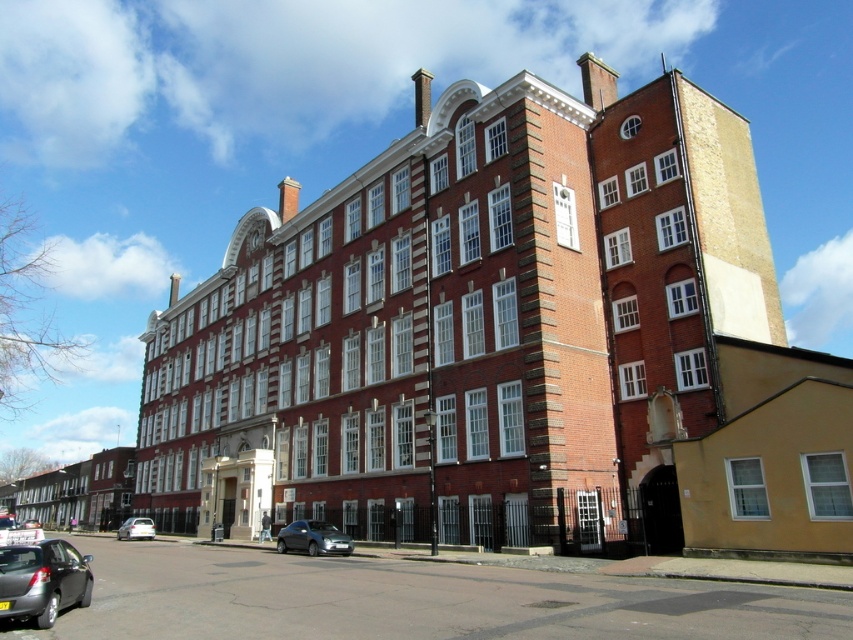
Question: Does matte black car at lower left appear on the left side of white matte car at lower left?

Choices:
 (A) yes
 (B) no

Answer: (B)

Question: Does matte black car at lower left appear under satin silver car at lower center?

Choices:
 (A) yes
 (B) no

Answer: (B)

Question: From the image, what is the correct spatial relationship of matte black car at lower left in relation to white matte car at lower left?

Choices:
 (A) left
 (B) right

Answer: (B)

Question: Among these objects, which one is nearest to the camera?

Choices:
 (A) matte black car at lower left
 (B) white matte car at lower left
 (C) satin silver car at lower center

Answer: (A)

Question: Which of these objects is positioned closest to the matte black car at lower left?

Choices:
 (A) satin silver car at lower center
 (B) white matte car at lower left

Answer: (A)

Question: Among these points, which one is farthest from the camera?

Choices:
 (A) (292, 532)
 (B) (38, 588)
 (C) (148, 522)

Answer: (C)